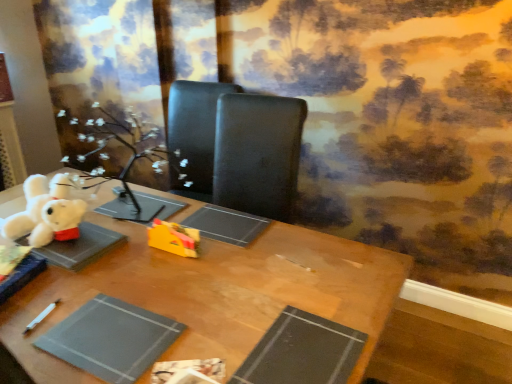
Find the location of a particular element. free point above wooden table at center (from a real-world perspective) is located at coordinates (165, 276).